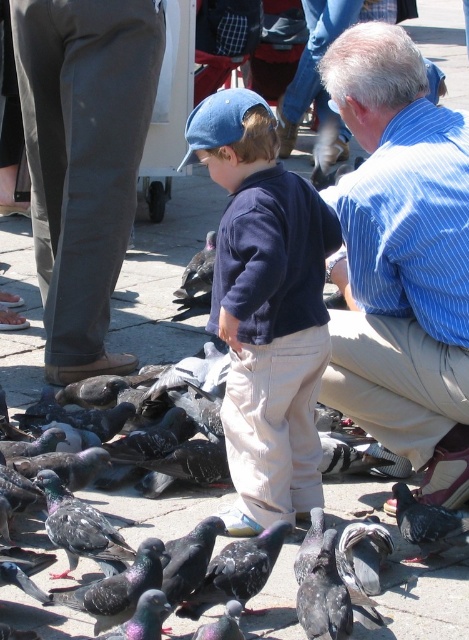
You are standing in the scene and want to hand a pigeon treat to the adult in the blue striped shirt at upper right. If you can throw the treat 4 meters, will it reach them?

The blue striped shirt at upper right is 5.07 meters away from the viewer, so the treat thrown 4 meters won not reach them.

You are a photographer trying to capture a photo of the gray speckled feathers at lower right without including the matte blue cap at center in the frame. Based on their positions, is this possible?

The matte blue cap at center is positioned on the left side of gray speckled feathers at lower right, so if you position your camera to the right side of the gray speckled feathers at lower right, you can avoid including the matte blue cap at center in the frame.